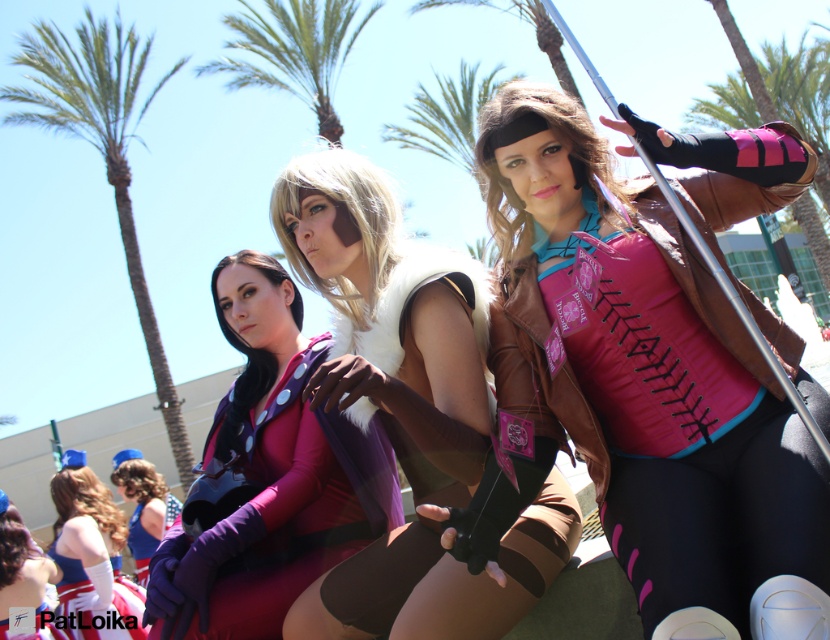
You are a photographer at the convention trying to capture a photo of the matte purple bodysuit at center and the green leafy palm tree at upper left in the background. Can you position yourself so that the palm tree appears above the bodysuit in the frame?

The matte purple bodysuit at center is below the green leafy palm tree at upper left, so yes, positioning yourself appropriately would allow the palm tree to appear above the bodysuit in the photo.

You are at a cosplay event and want to take a photo of the shiny metallic vest at center and the green leafy palm tree at center. Which object should you focus on first if you want to capture both in the same frame without moving your camera?

The shiny metallic vest at center should be focused on first because the green leafy palm tree at center is to the right of it, so adjusting the camera to include both would require framing from the vest towards the right where the palm tree is located.